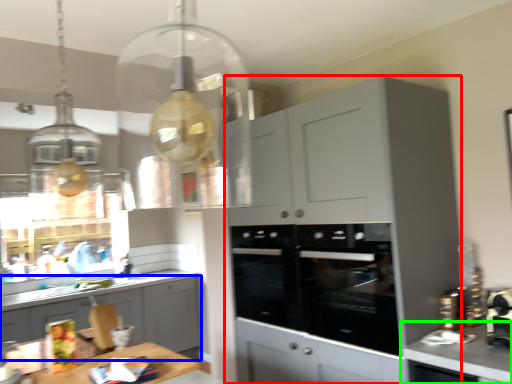
Question: Which object is the closest to the cabinetry (highlighted by a red box)? Choose among these: cabinetry (highlighted by a blue box) or countertop (highlighted by a green box).

Choices:
 (A) cabinetry
 (B) countertop

Answer: (B)